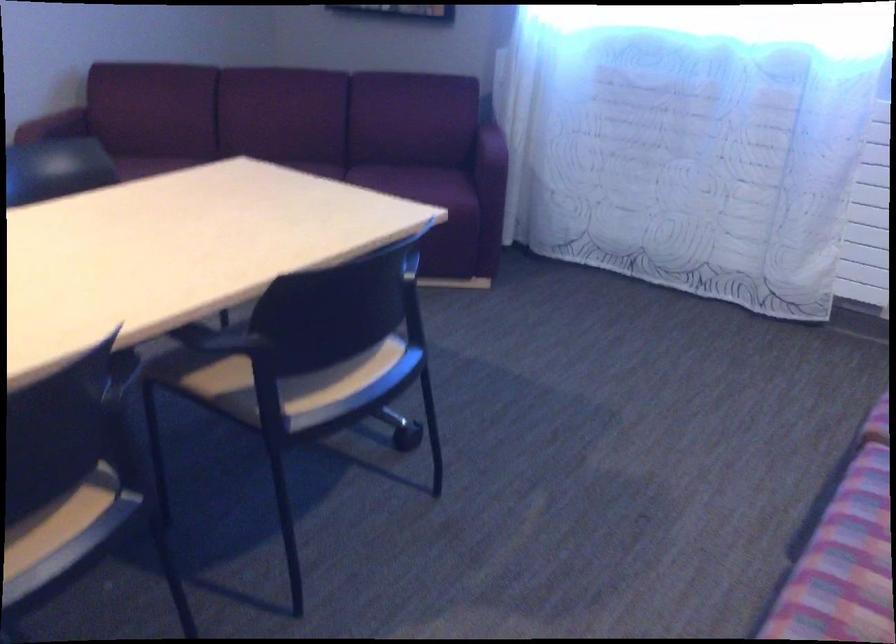
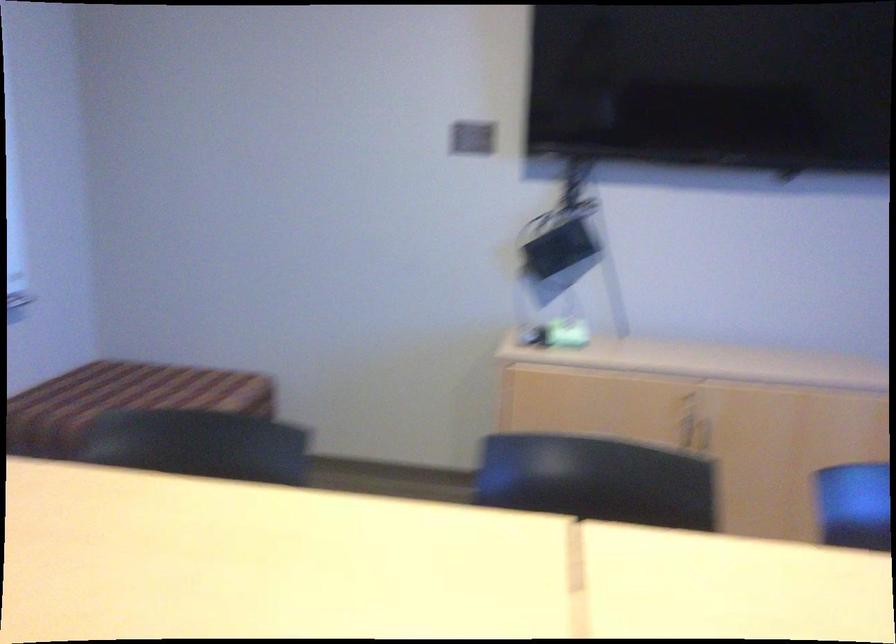
Question: The first image is from the beginning of the video and the second image is from the end. How did the camera likely rotate when shooting the video?

Choices:
 (A) Left
 (B) Right
 (C) Up
 (D) Down

Answer: (A)